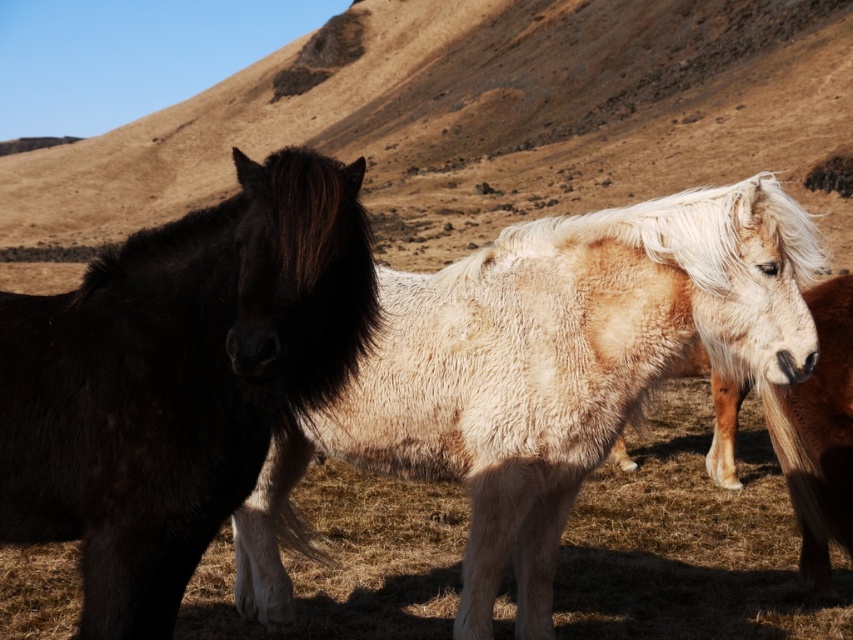
You are a photographer trying to capture a photo of the shiny black horse at left and the light brown fuzzy horse at right. If you want to ensure both horses are in focus, which one should you focus on first to account for their positions?

The shiny black horse at left is positioned over the light brown fuzzy horse at right, so you should focus on the shiny black horse at left first to ensure both are in focus.

You are a farmer who needs to separate two horses with a fence. The fluffy white horse at center and the light brown fuzzy horse at right are currently in the same field. If the minimum required distance between the two horses to ensure they can hear each other is 4 feet, will the fence placement at the current distance of 3.98 feet between them be acceptable?

The distance between the fluffy white horse at center and the light brown fuzzy horse at right is 3.98 feet, which is less than the required 4 feet. Therefore, the fence placement at this distance would not be acceptable as the horses can still hear each other.